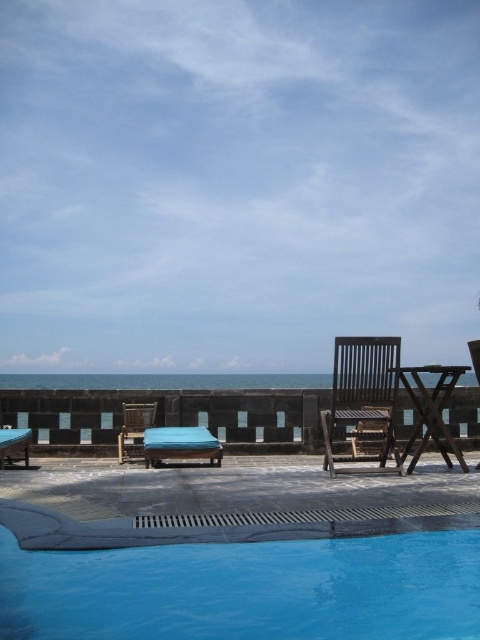
Does teal fabric chair at center appear over wooden beach chair at center?

Yes, teal fabric chair at center is above wooden beach chair at center.

Is teal fabric chair at center closer to camera compared to wooden beach chair at center?

Yes.

Image resolution: width=480 pixels, height=640 pixels. Describe the element at coordinates (180, 444) in the screenshot. I see `teal fabric chair at center` at that location.

Where is `teal fabric chair at center`? This screenshot has height=640, width=480. teal fabric chair at center is located at coordinates (180, 444).

Is point (342, 348) less distant than point (131, 428)?

Yes, point (342, 348) is in front of point (131, 428).

Can you confirm if dark brown wooden beach chair at center is bigger than wooden beach chair at center?

Yes.

Locate an element on the screen. Image resolution: width=480 pixels, height=640 pixels. dark brown wooden beach chair at center is located at coordinates (362, 403).

Who is positioned more to the right, blue smooth water at lower center or teal fabric chair at center?

blue smooth water at lower center is more to the right.

Consider the image. Which is above, blue smooth water at lower center or teal fabric chair at center?

blue smooth water at lower center is higher up.

Describe the element at coordinates (240, 580) in the screenshot. I see `blue smooth water at lower center` at that location.

You are a GUI agent. You are given a task and a screenshot of the screen. Output one action in this format:
    pyautogui.click(x=<x>, y=<y>)
    Task: Click on the blue smooth water at lower center
    
    Given the screenshot: What is the action you would take?
    pyautogui.click(x=240, y=580)